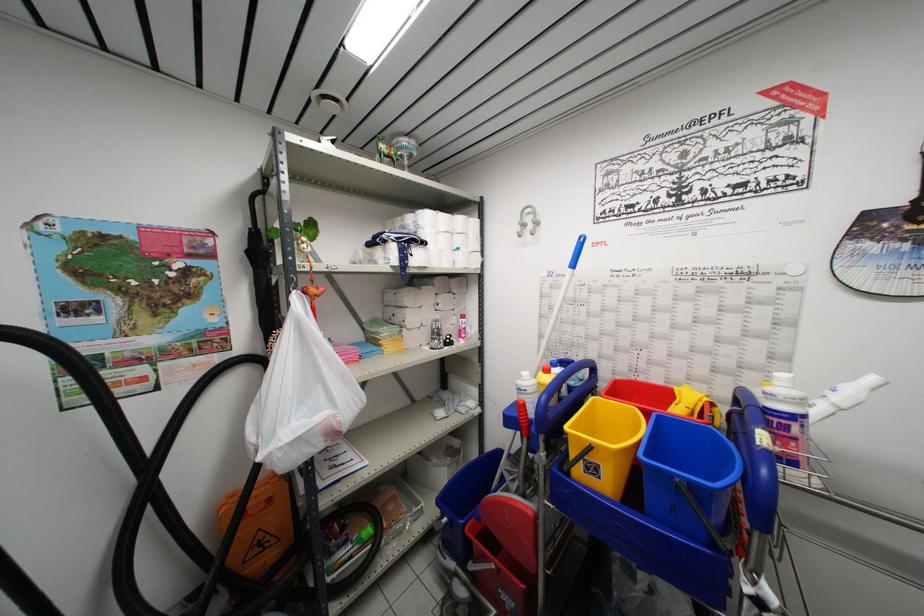
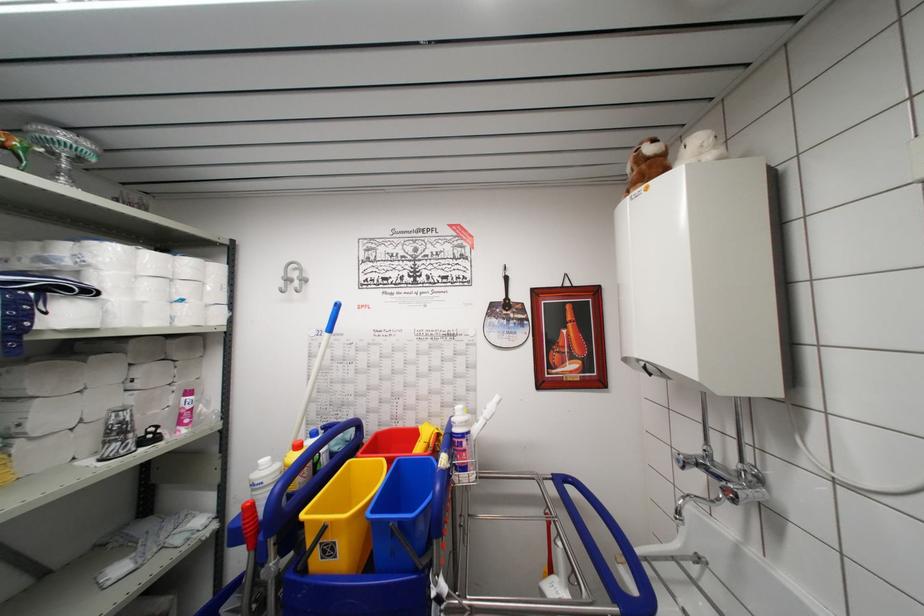
In the second image, find the point that corresponds to pixel 662 419 in the first image.

(402, 466)